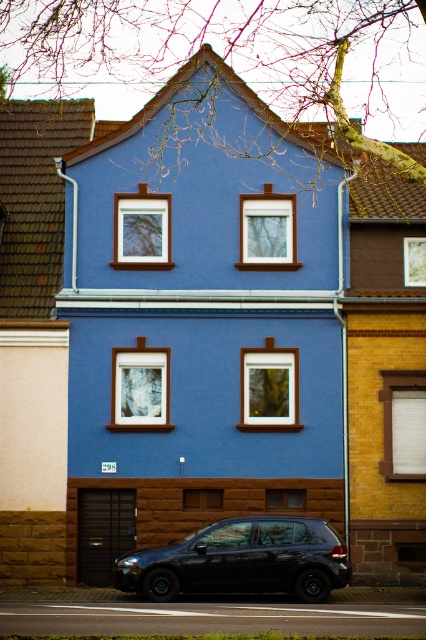
Does brown wood trim at center appear under black matte car at lower center?

Actually, brown wood trim at center is above black matte car at lower center.

Can you confirm if brown wood trim at center is positioned to the right of black matte car at lower center?

No, brown wood trim at center is not to the right of black matte car at lower center.

Is point (74, 570) less distant than point (227, 536)?

No.

This screenshot has height=640, width=426. I want to click on brown wood trim at center, so click(x=196, y=339).